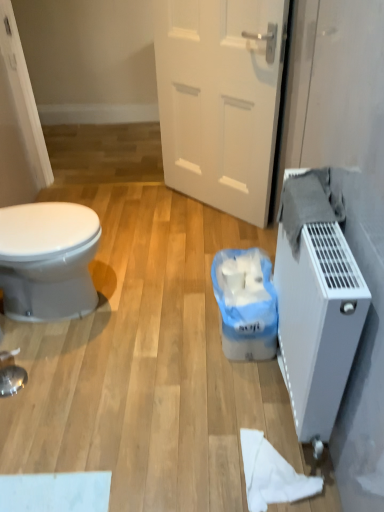
Find the location of a particular element. This screenshot has height=512, width=384. vacant area situated below white matte door at center (from a real-world perspective) is located at coordinates (209, 209).